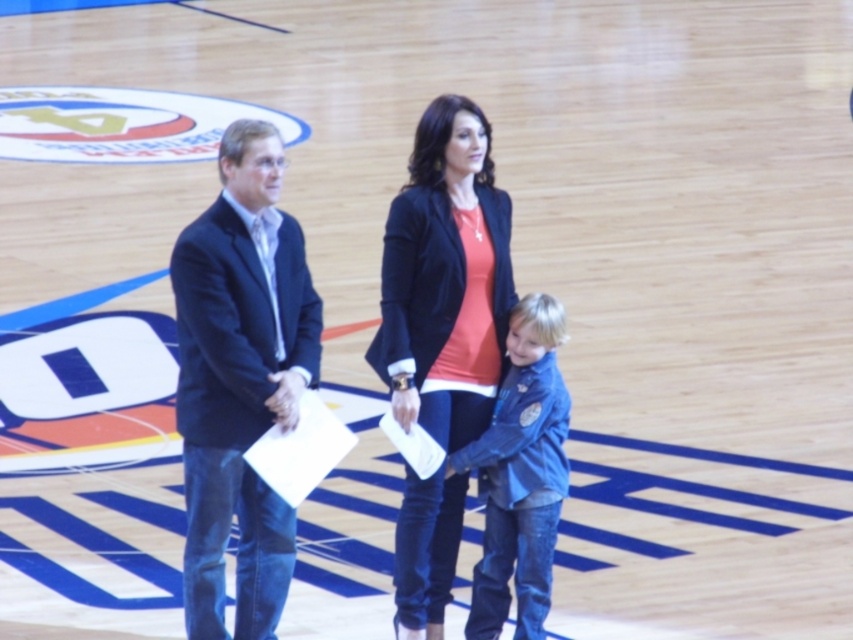
Can you confirm if matte black suit at left is wider than blue denim jacket at center?

Correct, the width of matte black suit at left exceeds that of blue denim jacket at center.

Does matte black suit at left have a larger size compared to blue denim jacket at center?

Indeed, matte black suit at left has a larger size compared to blue denim jacket at center.

Does point (488, 380) lie behind point (531, 308)?

Yes, point (488, 380) is farther from viewer.

This screenshot has width=853, height=640. Find the location of `matte black suit at left`. matte black suit at left is located at coordinates (445, 280).

Is velvet black blazer at center thinner than blue denim jacket at center?

No.

Who is more forward, (422, 166) or (468, 458)?

Point (422, 166)

At what (x,y) coordinates should I click in order to perform the action: click on velvet black blazer at center. Please return your answer as a coordinate pair (x, y). The height and width of the screenshot is (640, 853). Looking at the image, I should click on (445, 278).

Can you confirm if dark blue suit at left is positioned to the left of velvet black blazer at center?

Yes, dark blue suit at left is to the left of velvet black blazer at center.

This screenshot has height=640, width=853. Find the location of `dark blue suit at left`. dark blue suit at left is located at coordinates (241, 380).